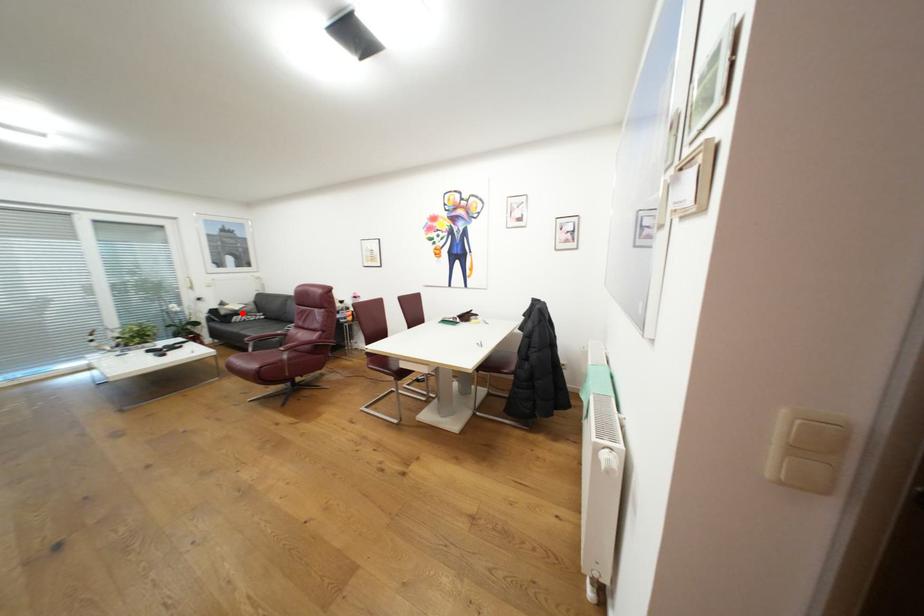
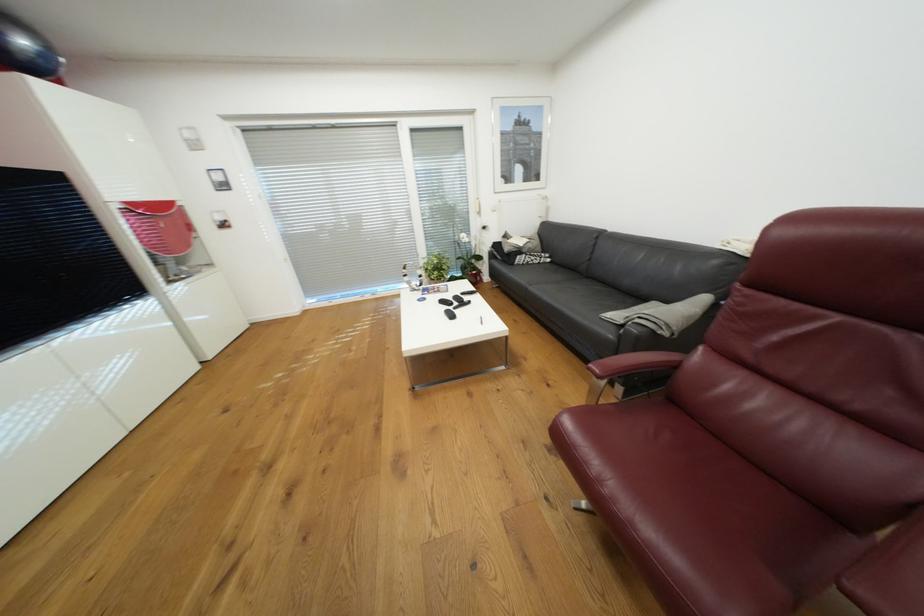
Question: I am providing you with two images of the same scene from different viewpoints. Image1 has a red point marked. In image2, the corresponding 3D location appears at what relative position? Reply with the corresponding letter.

Choices:
 (A) Closer
 (B) Farther

Answer: (A)